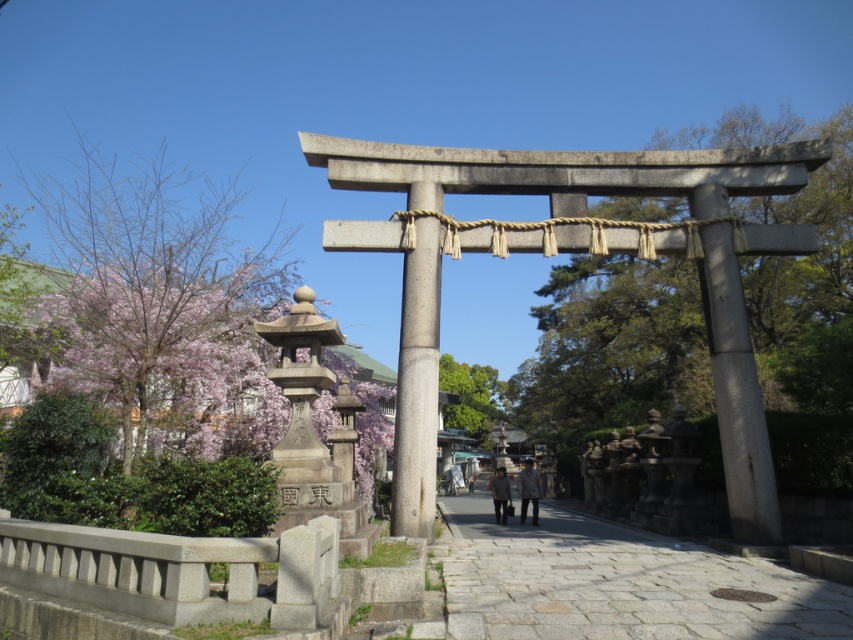
In order to click on paved stone path at center in this screenshot , I will do `click(618, 582)`.

Looking at this image, can you confirm if paved stone path at center is positioned below smooth gray pole at center?

Indeed, paved stone path at center is positioned under smooth gray pole at center.

Is point (440, 512) positioned behind point (397, 524)?

That is True.

Identify the location of paved stone path at center. The height and width of the screenshot is (640, 853). (618, 582).

Does smooth gray stone torii gate at center have a lesser height compared to dark gray jacket at center?

Correct, smooth gray stone torii gate at center is not as tall as dark gray jacket at center.

Between point (733, 252) and point (503, 468), which one is positioned in front?

Point (733, 252)

Is point (741, 412) less distant than point (506, 492)?

Yes, it is.

This screenshot has height=640, width=853. Identify the location of smooth gray stone torii gate at center. (735, 394).

Does smooth gray stone torii gate at center have a larger size compared to gray wool coat at center?

No, smooth gray stone torii gate at center is not bigger than gray wool coat at center.

Who is more distant from viewer, (741, 420) or (538, 493)?

Positioned behind is point (538, 493).

Does point (776, 524) come behind point (532, 499)?

No, (776, 524) is closer to viewer.

Identify the location of smooth gray stone torii gate at center. (735, 394).